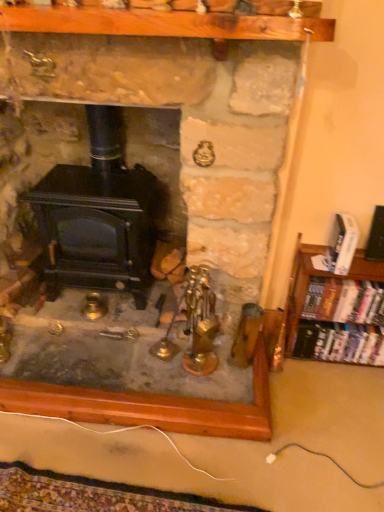
Find the location of a particular element. vacant area that lies in front of hardcover books at right, the 1th book in the bottom-to-top sequence is located at coordinates tap(339, 401).